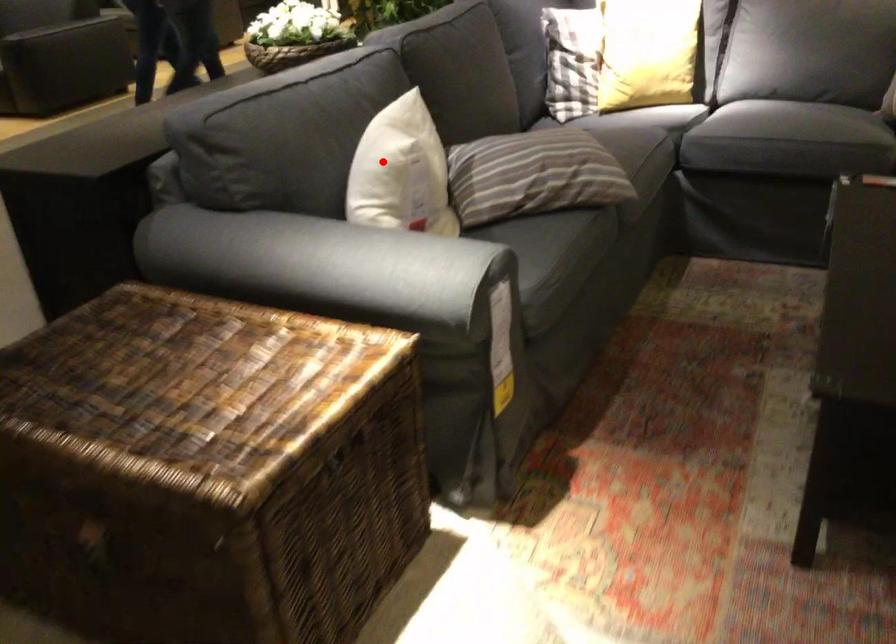
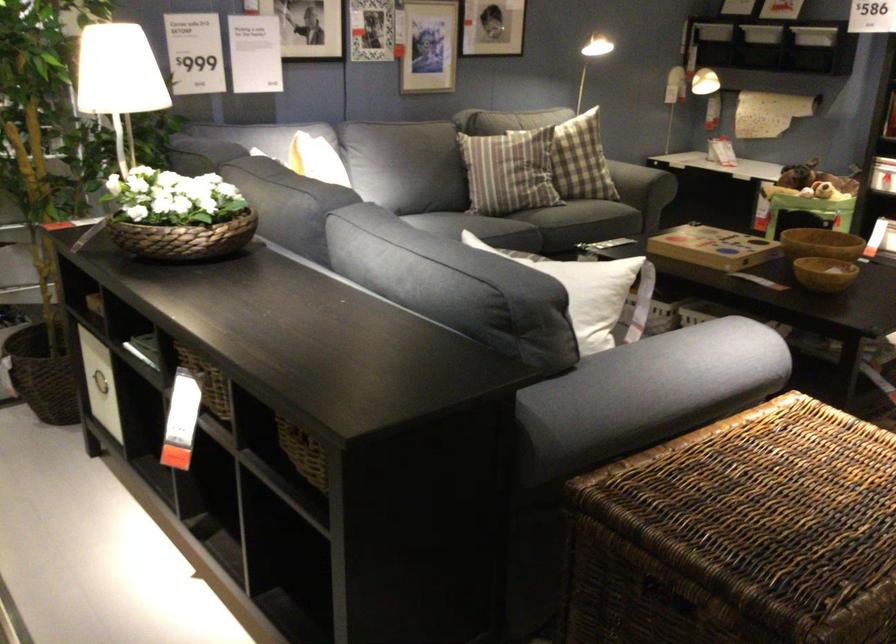
Locate, in the second image, the point that corresponds to the highlighted location in the first image.

(581, 272)